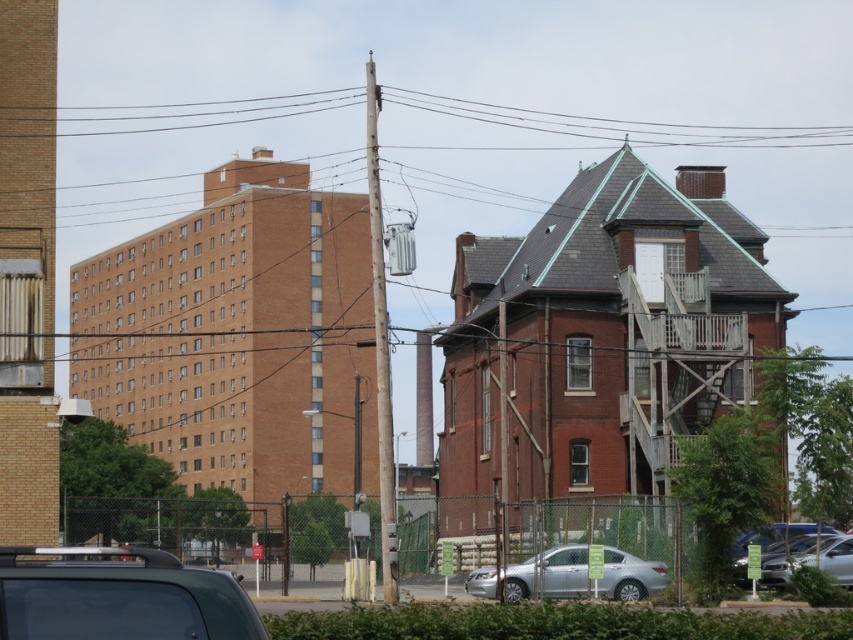
Can you confirm if silver metallic sedan at center is smaller than silver metallic car at lower right?

Yes, silver metallic sedan at center is smaller than silver metallic car at lower right.

Does silver metallic sedan at center have a greater width compared to silver metallic car at lower right?

In fact, silver metallic sedan at center might be narrower than silver metallic car at lower right.

What do you see at coordinates (549, 573) in the screenshot? The height and width of the screenshot is (640, 853). I see `silver metallic sedan at center` at bounding box center [549, 573].

The height and width of the screenshot is (640, 853). In order to click on silver metallic sedan at center in this screenshot , I will do `click(549, 573)`.

Is metallic gray car at lower left shorter than silver metallic car at lower right?

Correct, metallic gray car at lower left is not as tall as silver metallic car at lower right.

The width and height of the screenshot is (853, 640). Find the location of `metallic gray car at lower left`. metallic gray car at lower left is located at coordinates (120, 598).

What do you see at coordinates (120, 598) in the screenshot? Image resolution: width=853 pixels, height=640 pixels. I see `metallic gray car at lower left` at bounding box center [120, 598].

Locate an element on the screen. The height and width of the screenshot is (640, 853). metallic gray car at lower left is located at coordinates (120, 598).

In the scene shown: Can you confirm if metallic wire at upper center is positioned to the left of silver metallic car at lower right?

Indeed, metallic wire at upper center is positioned on the left side of silver metallic car at lower right.

Measure the distance between metallic wire at upper center and silver metallic car at lower right.

They are 67.44 meters apart.

Between point (846, 132) and point (836, 538), which one is positioned behind?

Positioned behind is point (846, 132).

Find the location of `metallic wire at upper center`. metallic wire at upper center is located at coordinates (622, 124).